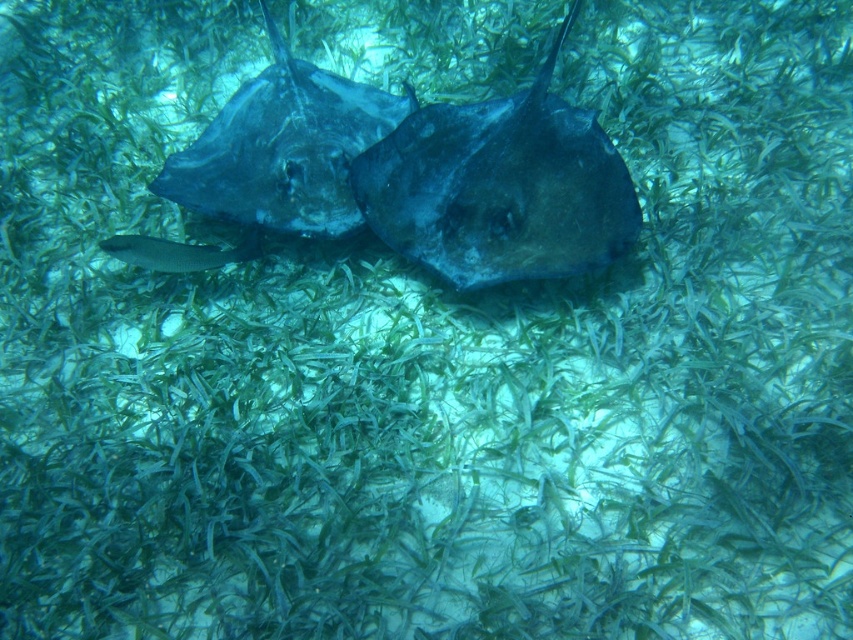
Question: Which object is the farthest from the dark blue glossy stingray at center?

Choices:
 (A) dark blue matte stingray at center
 (B) silvery metallic fish at center

Answer: (A)

Question: Which object is positioned farthest from the dark blue glossy stingray at center?

Choices:
 (A) silvery metallic fish at center
 (B) dark blue matte stingray at center

Answer: (B)

Question: Does dark blue matte stingray at center appear over silvery metallic fish at center?

Choices:
 (A) no
 (B) yes

Answer: (B)

Question: Can you confirm if dark blue glossy stingray at center is thinner than silvery metallic fish at center?

Choices:
 (A) yes
 (B) no

Answer: (B)

Question: Does dark blue matte stingray at center appear on the right side of dark blue glossy stingray at center?

Choices:
 (A) yes
 (B) no

Answer: (A)

Question: Which point is farther to the camera?

Choices:
 (A) (163, 182)
 (B) (526, 186)
 (C) (134, 237)

Answer: (A)